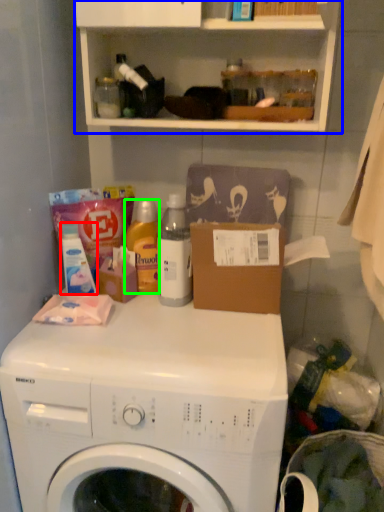
Question: Which object is positioned closest to toiletry (highlighted by a red box)? Select from cabinet (highlighted by a blue box) and cleaning product (highlighted by a green box).

Choices:
 (A) cabinet
 (B) cleaning product

Answer: (B)